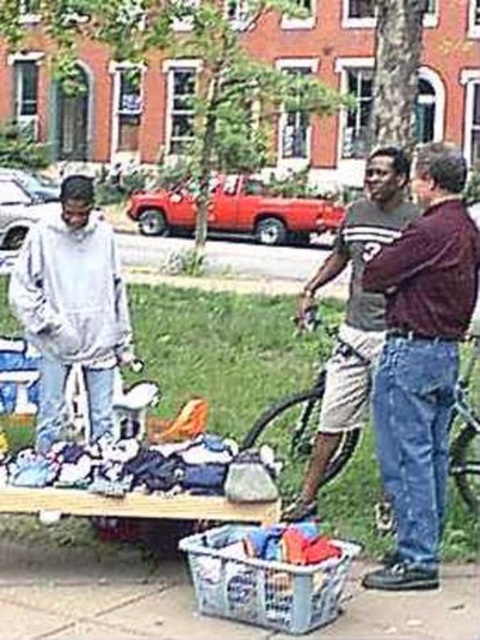
Is light gray hoodie at left shorter than gray cotton t-shirt at center?

No, light gray hoodie at left is not shorter than gray cotton t-shirt at center.

What do you see at coordinates (72, 308) in the screenshot?
I see `light gray hoodie at left` at bounding box center [72, 308].

Locate an element on the screen. This screenshot has width=480, height=640. light gray hoodie at left is located at coordinates (72, 308).

The image size is (480, 640). Identify the location of light gray hoodie at left. (72, 308).

Can you confirm if plastic crate at lower center is shorter than light gray hoodie at left?

Indeed, plastic crate at lower center has a lesser height compared to light gray hoodie at left.

Which is in front, point (13, 630) or point (17, 264)?

Positioned in front is point (13, 630).

Does point (112, 627) come closer to viewer compared to point (55, 436)?

Yes, it is.

Image resolution: width=480 pixels, height=640 pixels. I want to click on plastic crate at lower center, so click(x=192, y=602).

Locate an element on the screen. This screenshot has width=480, height=640. light gray hoodie at left is located at coordinates (72, 308).

Describe the element at coordinates (72, 308) in the screenshot. The image size is (480, 640). I see `light gray hoodie at left` at that location.

At what (x,y) coordinates should I click in order to perform the action: click on light gray hoodie at left. Please return your answer as a coordinate pair (x, y). This screenshot has height=640, width=480. Looking at the image, I should click on (x=72, y=308).

Find the location of `light gray hoodie at left`. light gray hoodie at left is located at coordinates (72, 308).